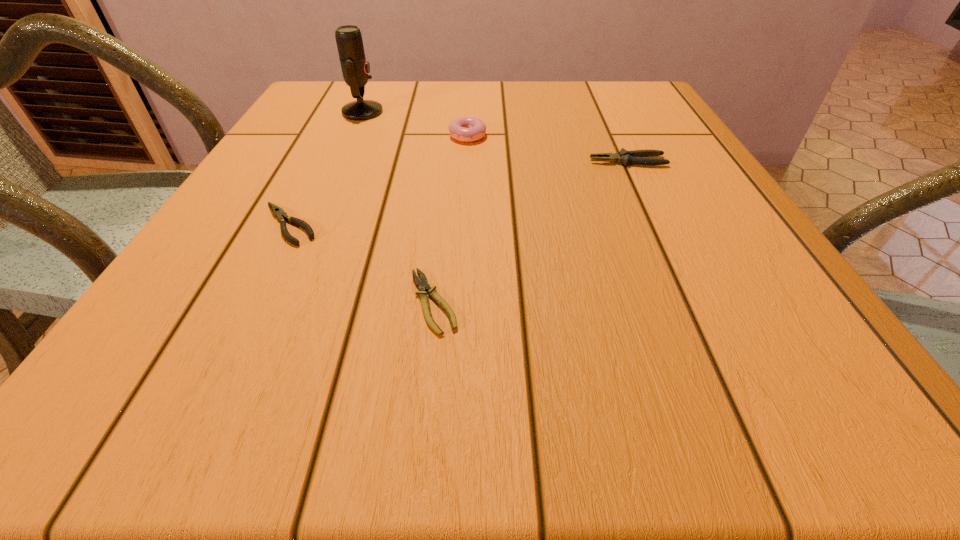
Where is `free space that is in between the rightmost object and the farthest object`? free space that is in between the rightmost object and the farthest object is located at coordinates (495, 137).

I want to click on free space between the fourth shortest object and the leftmost pliers, so click(x=378, y=179).

The width and height of the screenshot is (960, 540). Find the location of `unoccupied position between the microphone and the second farthest pliers`. unoccupied position between the microphone and the second farthest pliers is located at coordinates (325, 168).

The width and height of the screenshot is (960, 540). I want to click on vacant area that lies between the fourth farthest object and the farthest pliers, so click(458, 193).

Locate an element on the screen. unoccupied area between the doughnut and the second nearest object is located at coordinates (378, 179).

The height and width of the screenshot is (540, 960). I want to click on vacant space in between the nearest object and the rightmost object, so click(531, 232).

The image size is (960, 540). Find the location of `unoccupied position between the nearest object and the doughnut`. unoccupied position between the nearest object and the doughnut is located at coordinates click(450, 218).

Locate an element on the screen. free space between the second pliers from right to left and the tallest pliers is located at coordinates (531, 232).

I want to click on the closest object relative to the third nearest object, so click(466, 129).

What are the coordinates of `object that is the second closest one to the microphone` in the screenshot? It's located at (278, 212).